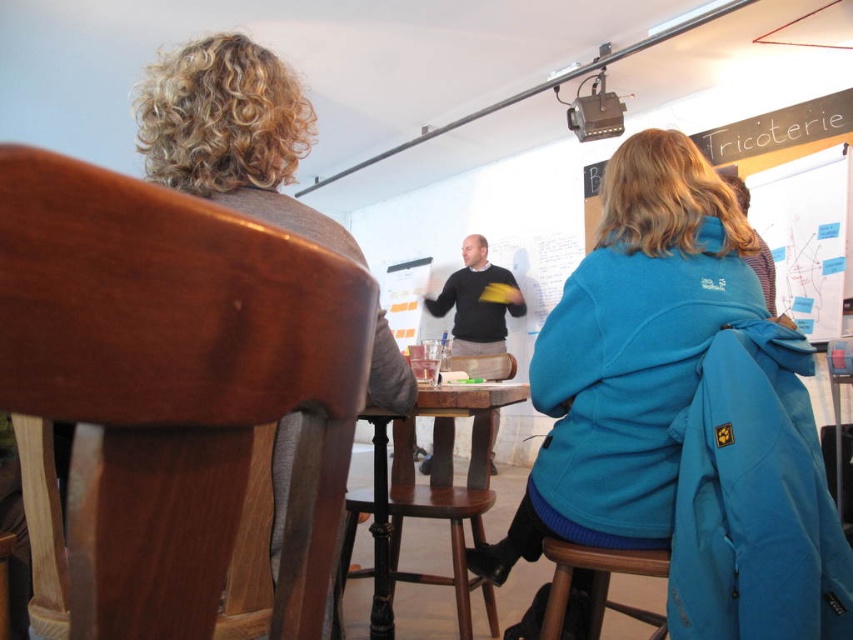
Is wooden table at center wider than wooden bar stool at lower right?

Correct, the width of wooden table at center exceeds that of wooden bar stool at lower right.

Which is behind, point (347, 515) or point (582, 568)?

Point (347, 515)

Does point (488, 458) lie in front of point (550, 557)?

That is False.

Image resolution: width=853 pixels, height=640 pixels. Identify the location of wooden table at center. (431, 499).

From the picture: Does brown leather chair at left appear over black matte sweater at center?

Correct, brown leather chair at left is located above black matte sweater at center.

Can you confirm if brown leather chair at left is taller than black matte sweater at center?

Correct, brown leather chair at left is much taller as black matte sweater at center.

Does point (178, 186) come in front of point (476, 285)?

Yes, point (178, 186) is closer to viewer.

You are a GUI agent. You are given a task and a screenshot of the screen. Output one action in this format:
    pyautogui.click(x=<x>, y=<y>)
    Task: Click on the brown leather chair at left
    
    Given the screenshot: What is the action you would take?
    pyautogui.click(x=231, y=132)

Is point (514, 300) more distant than point (613, 563)?

Yes, point (514, 300) is farther from viewer.

Does black matte sweater at center have a lesser height compared to wooden bar stool at lower right?

No, black matte sweater at center is not shorter than wooden bar stool at lower right.

What do you see at coordinates (476, 301) in the screenshot? The width and height of the screenshot is (853, 640). I see `black matte sweater at center` at bounding box center [476, 301].

I want to click on black matte sweater at center, so pos(476,301).